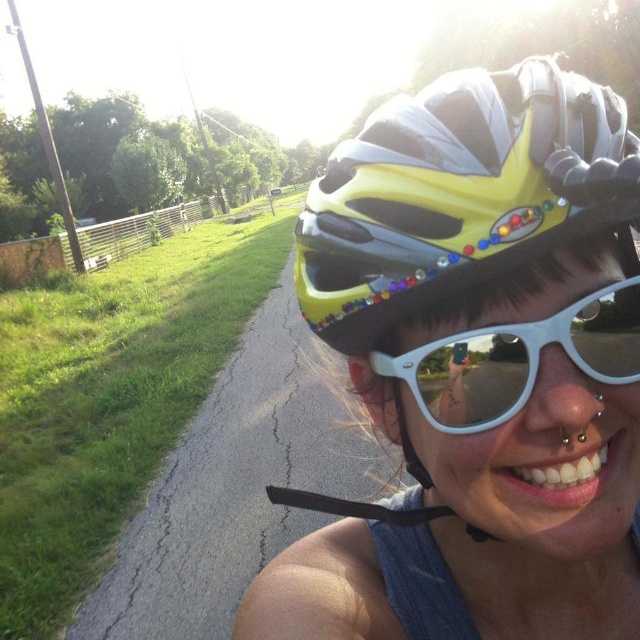
You are a photographer trying to capture the person wearing the yellow matte helmet at center and white reflective sunglasses at center. If your camera has a depth of field that can focus on objects within a 10 inch range, will both items be in focus?

The distance between the yellow matte helmet at center and white reflective sunglasses at center is 10.19 inches, which exceeds the camera lens depth of field range of 10 inches. Therefore, both items cannot be in focus simultaneously.

Where is the yellow matte helmet at center located in the image?

The yellow matte helmet at center is located at point (477, 368) in the image.

You are a photographer trying to capture the person in the scene. You notice the yellow matte helmet at center and the white reflective sunglasses at center. Which object should you focus on if you want to capture the wider object in your shot?

The yellow matte helmet at center is wider than the white reflective sunglasses at center, so focusing on the yellow matte helmet at center would allow you to capture the wider object in your shot.